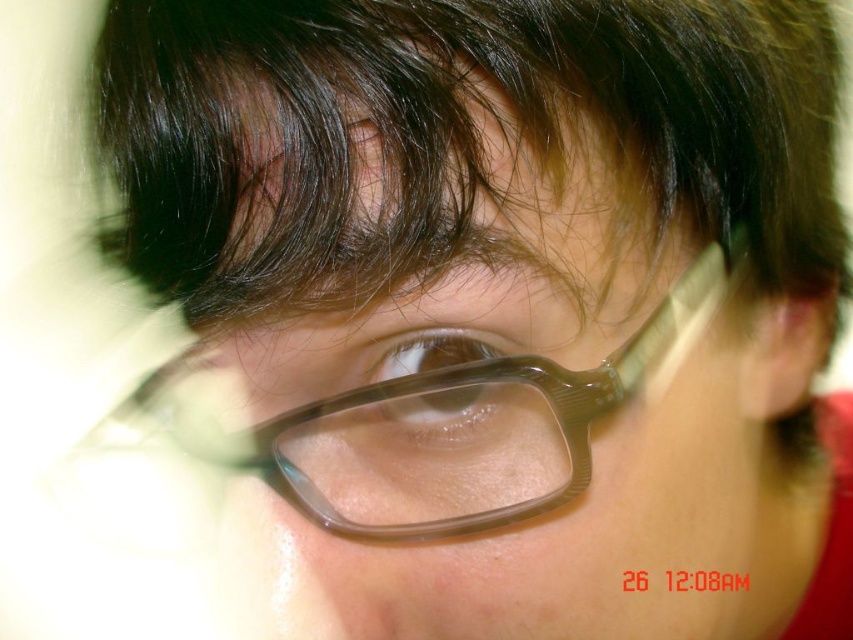
You are a photographer adjusting the lighting for a portrait. You notice the transparent plastic glasses at center and the translucent plastic eye at center in the image. Which object is covering the other?

The transparent plastic glasses at center is positioned over the translucent plastic eye at center, so the glasses are covering the eye.

You are a photographer adjusting your camera settings to focus on either the transparent plastic glasses at center or the translucent plastic eye at center. Which object should you focus on first if you want to ensure the closer object is sharp?

You should focus on the transparent plastic glasses at center first because it is closer to the viewer than the translucent plastic eye at center.